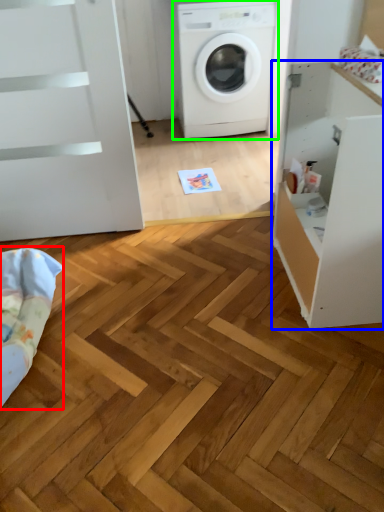
Question: Estimate the real-world distances between objects in this image. Which object is closer to bedding (highlighted by a red box), file cabinet (highlighted by a blue box) or washing machine (highlighted by a green box)?

Choices:
 (A) file cabinet
 (B) washing machine

Answer: (A)